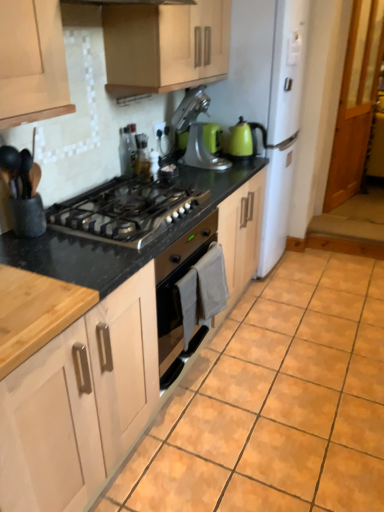
Identify the location of free point above natural wood cabinet doors at lower left, which appears as the first cabinetry when ordered from the bottom (from a real-world perspective). This screenshot has height=512, width=384. (46, 265).